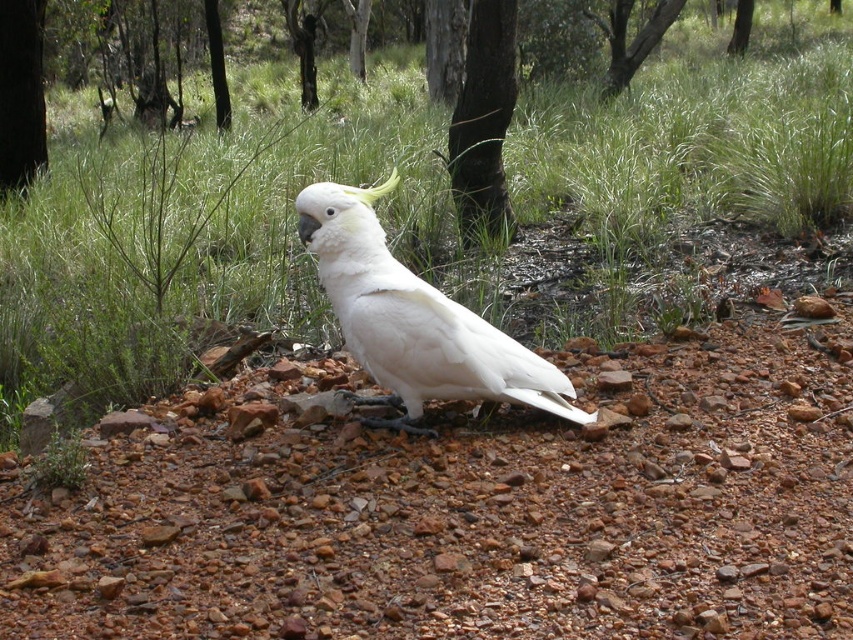
Is point (445, 211) positioned in front of point (4, 93)?

Yes.

Is point (788, 99) farther from camera compared to point (12, 138)?

Yes, point (788, 99) is farther from viewer.

At what (x,y) coordinates should I click in order to perform the action: click on green grass at center. Please return your answer as a coordinate pair (x, y). Looking at the image, I should click on (552, 182).

Find the location of a particular element. Image resolution: width=853 pixels, height=640 pixels. green grass at center is located at coordinates click(552, 182).

Between white feathered parrot at center and green leafy tree at upper center, which one has less height?

Standing shorter between the two is white feathered parrot at center.

I want to click on white feathered parrot at center, so click(415, 320).

Who is shorter, dark brown bark at left or green smooth tree at upper center?

dark brown bark at left is shorter.

Does dark brown bark at left have a larger size compared to green smooth tree at upper center?

No.

What do you see at coordinates (21, 92) in the screenshot?
I see `dark brown bark at left` at bounding box center [21, 92].

I want to click on dark brown bark at left, so click(x=21, y=92).